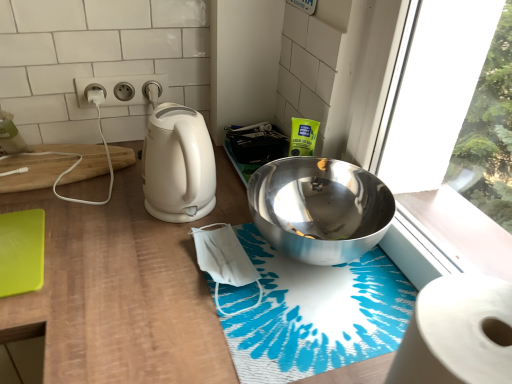
The width and height of the screenshot is (512, 384). Identify the location of vacant space in front of white glossy electric kettle at left. (139, 268).